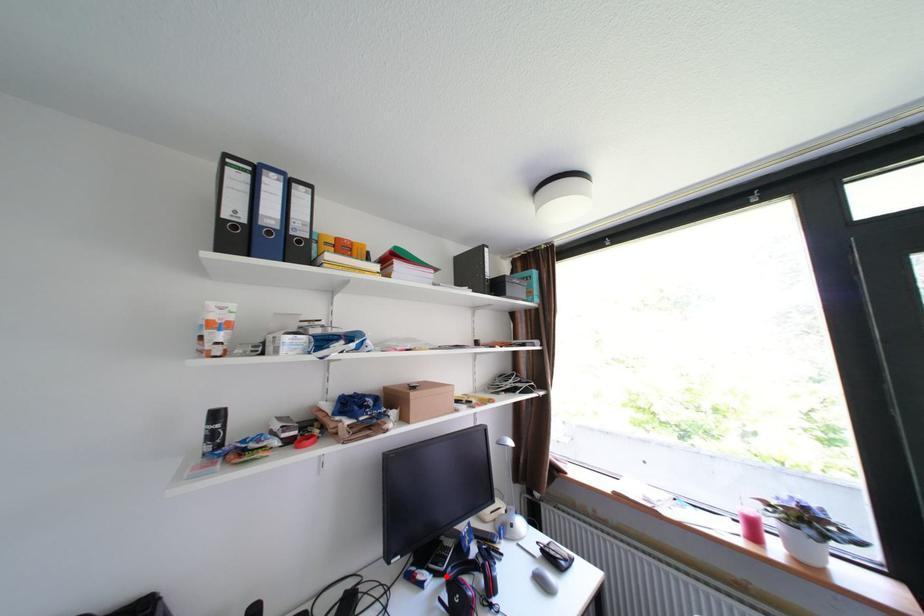
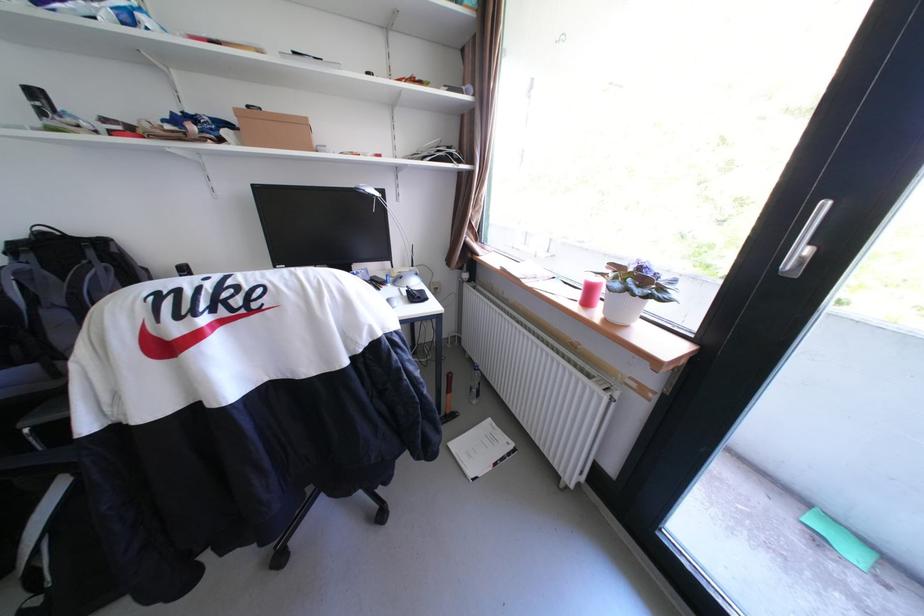
Question: I am providing you with two images of the same scene from different viewpoints. A red point is marked on the first image. Can you still see the location of the red point in image 2?

Choices:
 (A) Yes
 (B) No

Answer: (B)